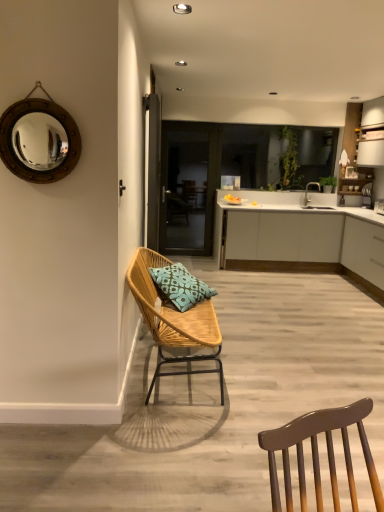
You are a GUI agent. You are given a task and a screenshot of the screen. Output one action in this format:
    pyautogui.click(x=<x>, y=<y>)
    Task: Click on the free space in front of woven wood chair with blue patterned cushion at left
    
    Given the screenshot: What is the action you would take?
    pyautogui.click(x=155, y=455)